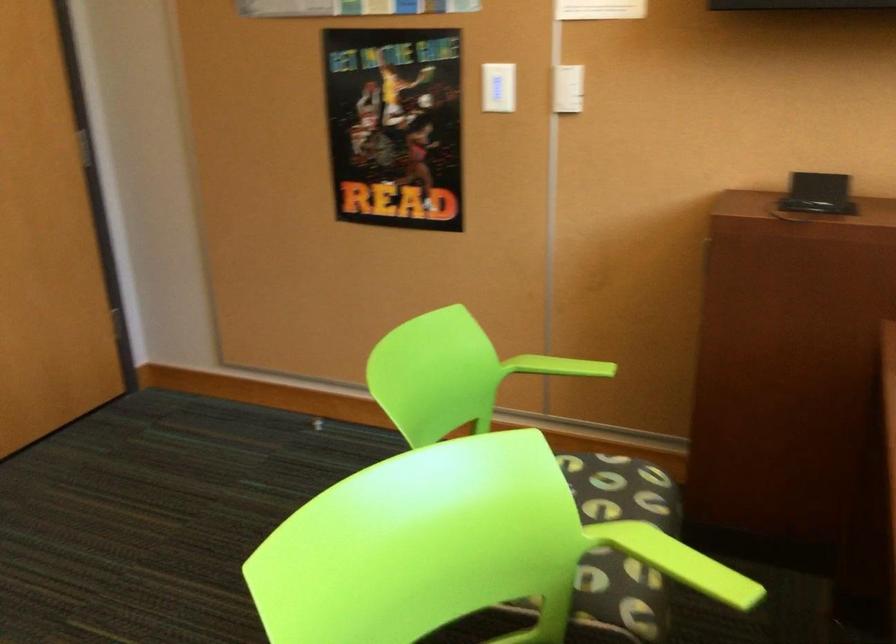
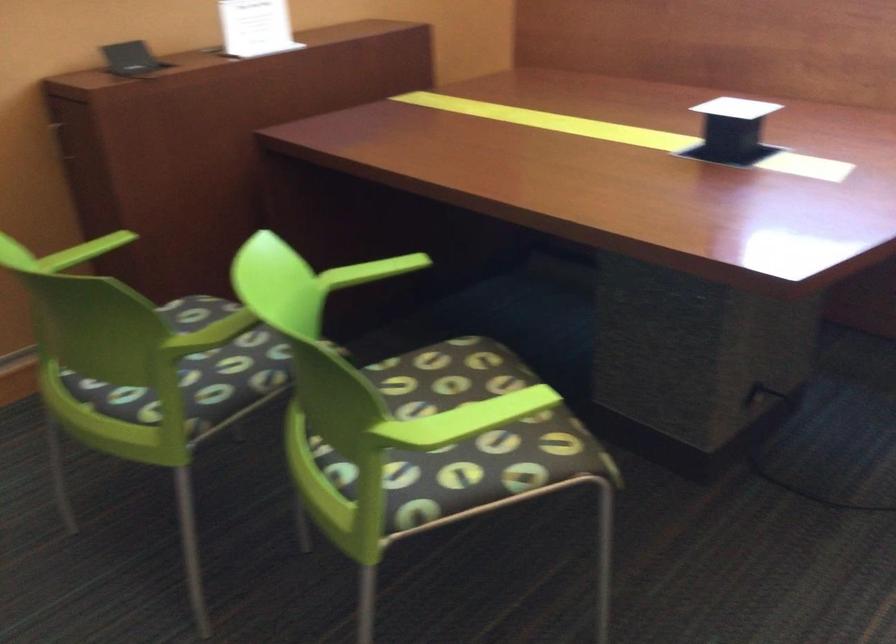
How did the camera likely rotate?

The camera's rotation is toward right-down.